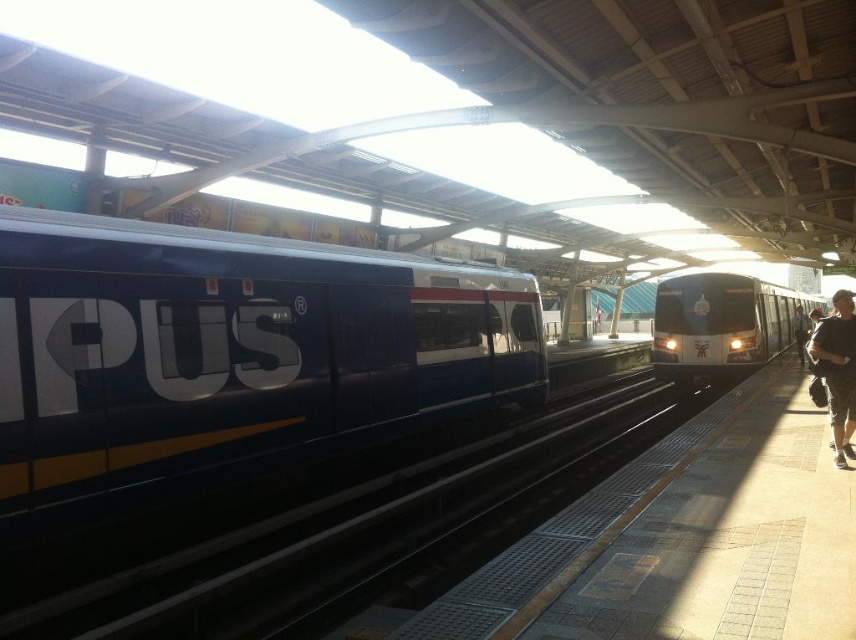
Question: Is shiny silver train at center positioned behind black fabric bag at right?

Choices:
 (A) yes
 (B) no

Answer: (A)

Question: Is black metal train track at center bigger than shiny silver train at center?

Choices:
 (A) yes
 (B) no

Answer: (B)

Question: Is blue glossy train at left wider than shiny silver train at center?

Choices:
 (A) yes
 (B) no

Answer: (B)

Question: Which of these objects is positioned closest to the black fabric bag at right?

Choices:
 (A) black metal train track at center
 (B) shiny silver train at center
 (C) blue glossy train at left
 (D) black leather jacket at right

Answer: (A)

Question: Which of these objects is positioned farthest from the black fabric bag at right?

Choices:
 (A) black leather jacket at right
 (B) black metal train track at center
 (C) shiny silver train at center

Answer: (A)

Question: Which point appears farthest from the camera in this image?

Choices:
 (A) (849, 326)
 (B) (388, 257)
 (C) (741, 332)
 (D) (201, 612)

Answer: (C)